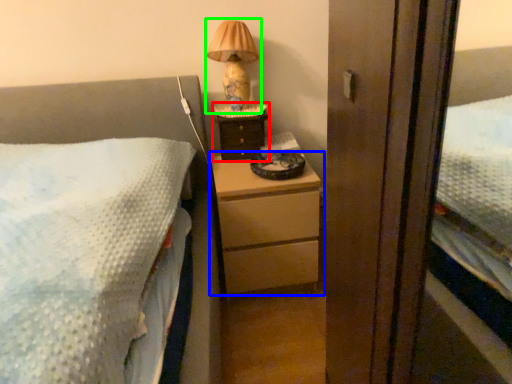
Question: Which is nearer to the nightstand (highlighted by a red box)? chest of drawers (highlighted by a blue box) or table lamp (highlighted by a green box).

Choices:
 (A) chest of drawers
 (B) table lamp

Answer: (B)